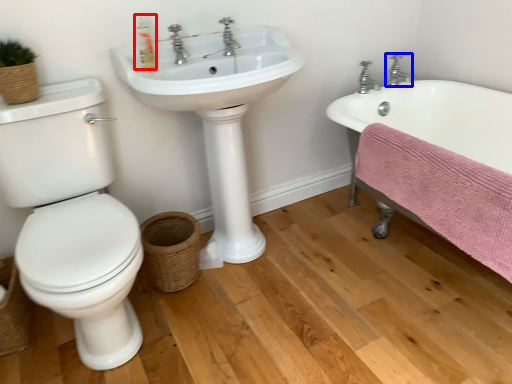
Question: Which of the following is the closest to the observer, soap dispenser (highlighted by a red box) or tap (highlighted by a blue box)?

Choices:
 (A) soap dispenser
 (B) tap

Answer: (A)